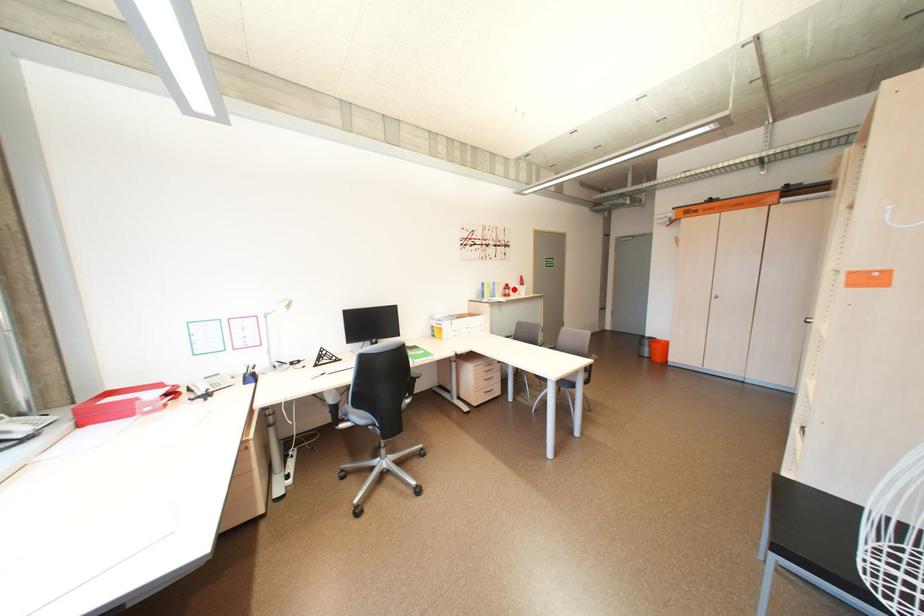
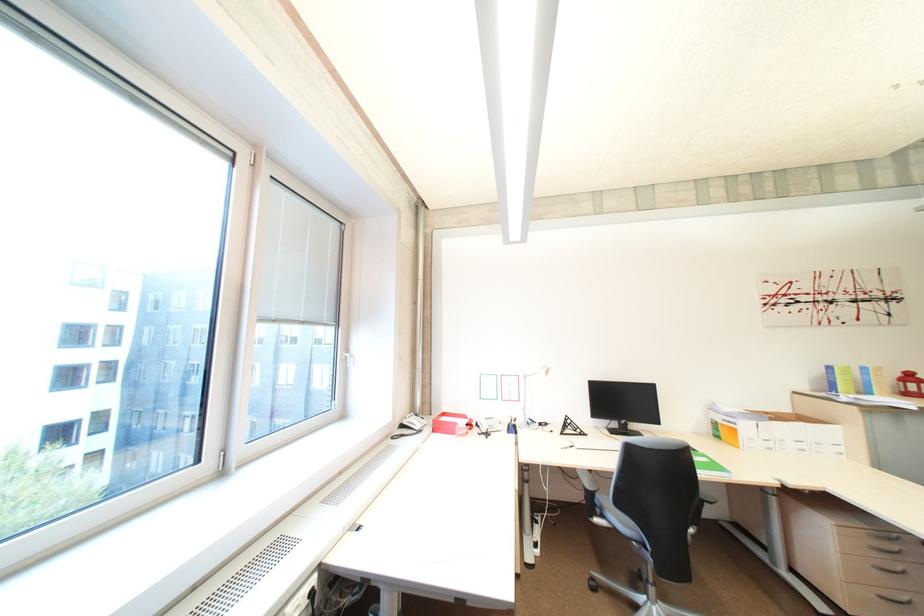
Question: I am providing you with two images of the same scene from different viewpoints. In image1, a red point is highlighted. Considering the same 3D point in image2, which of the following is correct?

Choices:
 (A) It is closer
 (B) It is farther

Answer: (A)